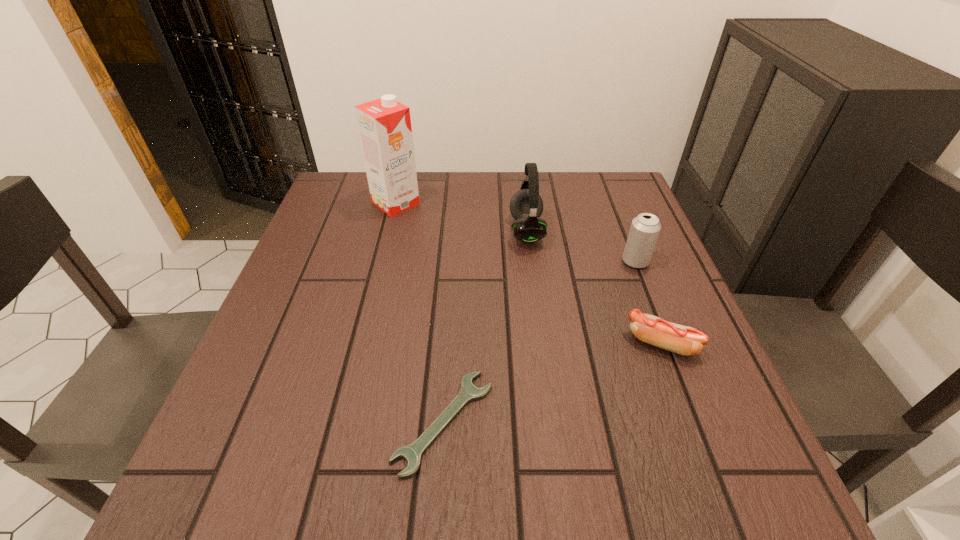
The height and width of the screenshot is (540, 960). Find the location of `carton`. carton is located at coordinates (384, 125).

Image resolution: width=960 pixels, height=540 pixels. Identify the location of the leftmost object. (384, 125).

Locate an element on the screen. the second tallest object is located at coordinates (526, 206).

Find the location of a particular element. the third object from right to left is located at coordinates (526, 206).

Identify the location of the third tallest object. (645, 228).

Where is `beer can`? This screenshot has width=960, height=540. beer can is located at coordinates (645, 228).

The height and width of the screenshot is (540, 960). What are the coordinates of `the fourth tallest object` in the screenshot? It's located at (683, 340).

Find the location of a particular element. This screenshot has width=960, height=540. sausage is located at coordinates (683, 340).

Find the location of `wrench`. wrench is located at coordinates [x=412, y=453].

You are a GUI agent. You are given a task and a screenshot of the screen. Output one action in this format:
    pyautogui.click(x=<x>, y=<y>)
    Task: Click on the shortest object
    
    Given the screenshot: What is the action you would take?
    pyautogui.click(x=412, y=453)